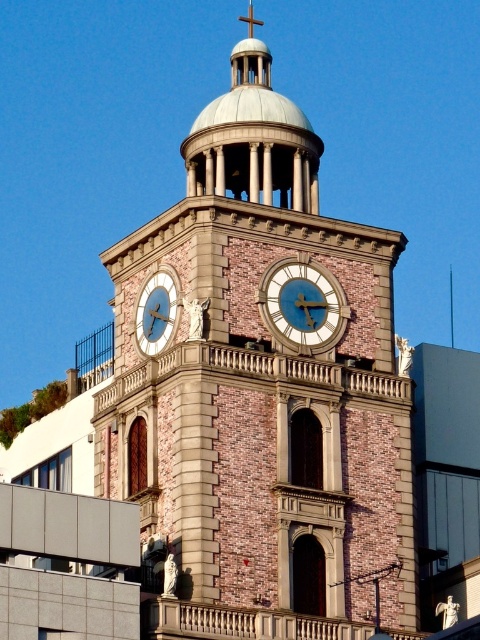
Is brown brick clock tower at center smaller than blue painted metal clock at center?

No.

Who is more distant from viewer, (216, 204) or (317, 268)?

Point (317, 268)

Where is `brown brick clock tower at center`? Image resolution: width=480 pixels, height=640 pixels. brown brick clock tower at center is located at coordinates (260, 396).

Where is `brown brick clock tower at center`? The height and width of the screenshot is (640, 480). brown brick clock tower at center is located at coordinates (260, 396).

What do you see at coordinates (260, 396) in the screenshot?
I see `brown brick clock tower at center` at bounding box center [260, 396].

Identify the location of brown brick clock tower at center. The width and height of the screenshot is (480, 640). (260, 396).

Who is taller, blue painted metal clock at center or matte gold clock at center?

Standing taller between the two is matte gold clock at center.

Between point (325, 292) and point (144, 296), which one is positioned in front?

Point (325, 292) is more forward.

Where is `blue painted metal clock at center`? The height and width of the screenshot is (640, 480). blue painted metal clock at center is located at coordinates (302, 305).